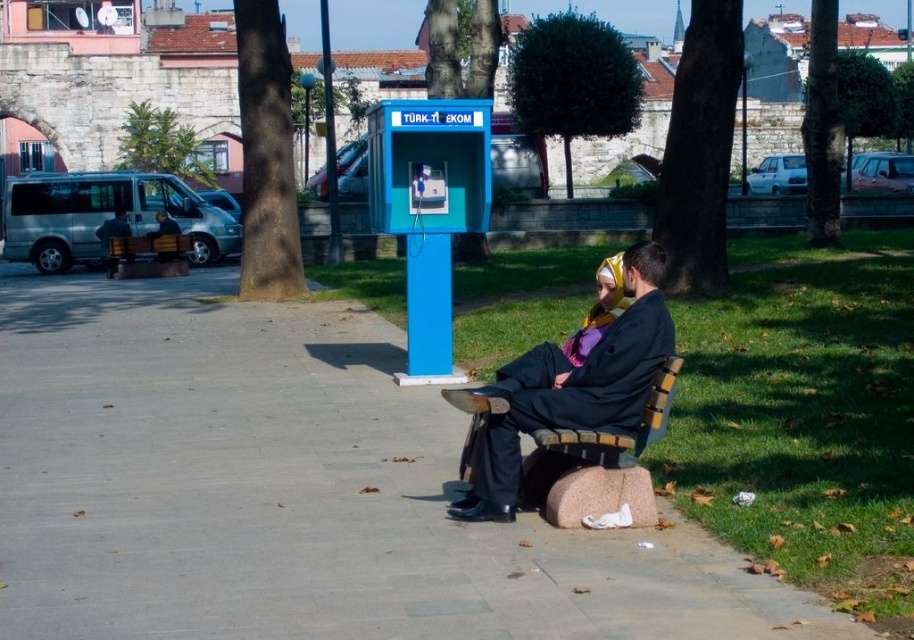
Question: Is wooden bench at center above dark blue suit at center?

Choices:
 (A) yes
 (B) no

Answer: (B)

Question: Estimate the real-world distances between objects in this image. Which object is farther from the wooden bench at center?

Choices:
 (A) black matte robe at center
 (B) dark blue suit at center
 (C) smooth concrete pavement at center

Answer: (A)

Question: Which object is positioned closest to the dark blue suit at center?

Choices:
 (A) dark blue suit at left
 (B) smooth concrete pavement at center

Answer: (A)

Question: From the image, what is the correct spatial relationship of black matte robe at center in relation to dark blue suit at center?

Choices:
 (A) right
 (B) left

Answer: (A)

Question: Which point is closer to the camera?

Choices:
 (A) dark blue suit at center
 (B) blue plastic phone booth at center

Answer: (B)

Question: Can you confirm if blue plastic phone booth at center is positioned above dark blue suit at center?

Choices:
 (A) no
 (B) yes

Answer: (B)